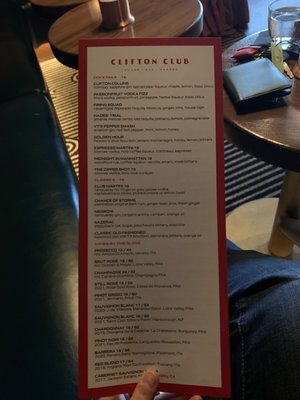
At what (x,y) coordinates should I click in order to perform the action: click on glass. Please return your answer as a coordinate pair (x, y). This screenshot has height=400, width=300. Looking at the image, I should click on (288, 28).